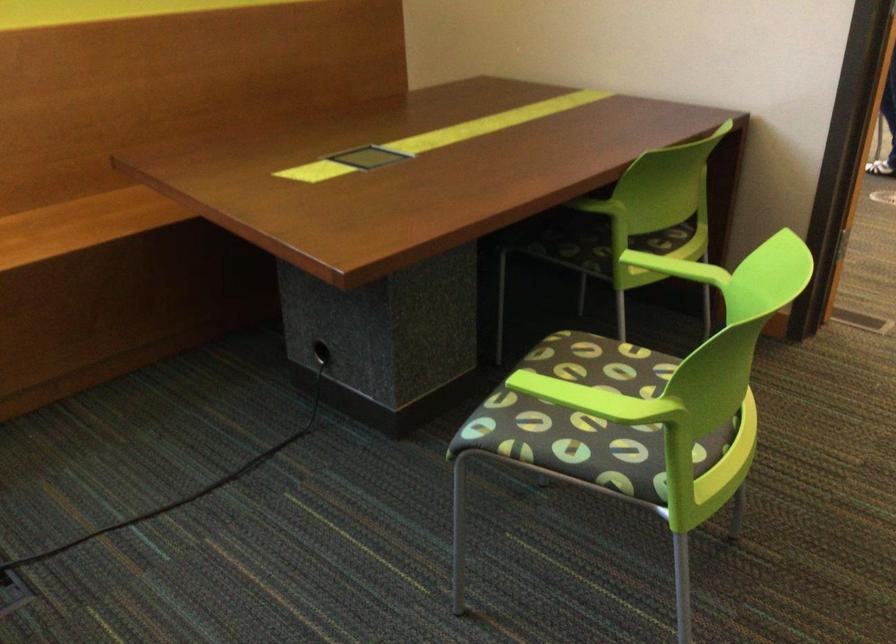
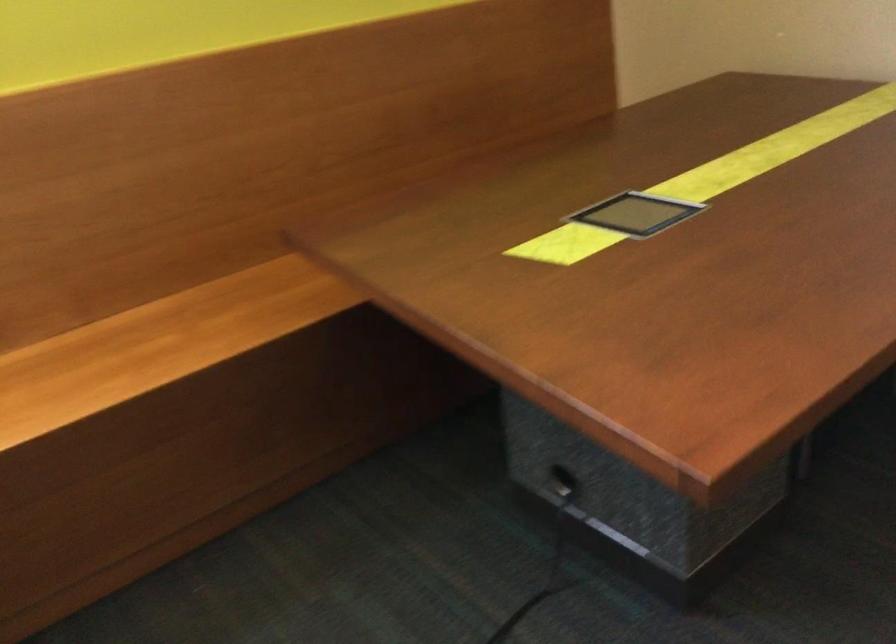
The images are taken continuously from a first-person perspective. In which direction are you moving?

The cameraman moved toward left, forward.